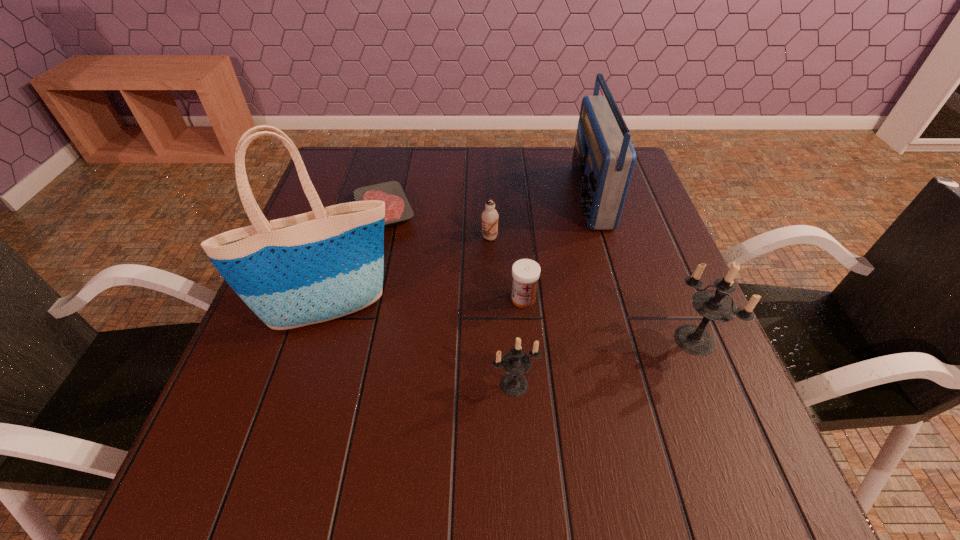
In the current image, all candle holders are evenly spaced. To maintain this equal spacing, where should an additional candle holder be placed on the left? Please point out a free spot. Please provide its 2D coordinates. Your answer should be formatted as a tuple, i.e. [(x, y)], where the tuple contains the x and y coordinates of a point satisfying the conditions above.

[(300, 437)]